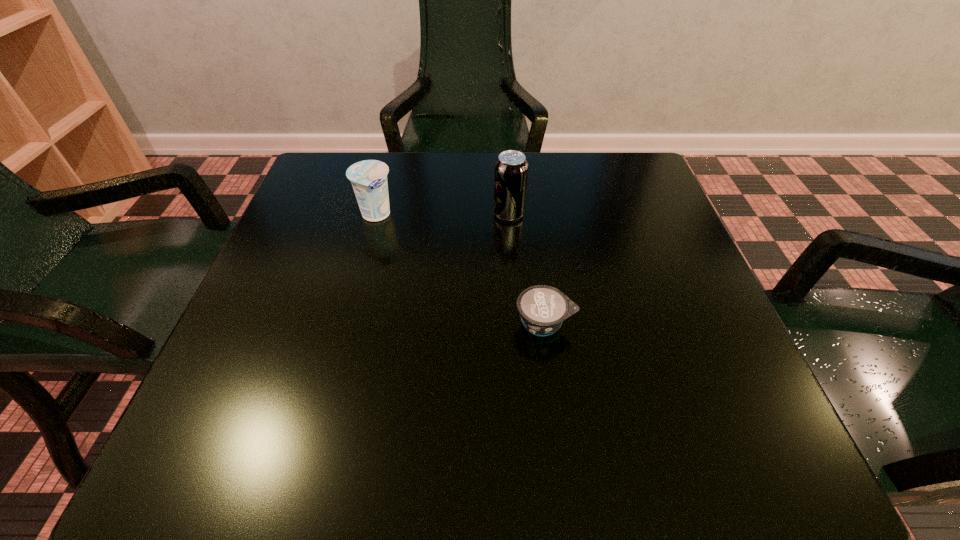
Where is `the tallest object`? The width and height of the screenshot is (960, 540). the tallest object is located at coordinates (511, 169).

You are a GUI agent. You are given a task and a screenshot of the screen. Output one action in this format:
    pyautogui.click(x=<x>, y=<y>)
    Task: Click on the taller yogurt
    This screenshot has height=540, width=960.
    Given the screenshot: What is the action you would take?
    pyautogui.click(x=368, y=178)

Find the location of a particular element. The width and height of the screenshot is (960, 540). the farther yogurt is located at coordinates (368, 178).

I want to click on the nearest object, so click(x=542, y=308).

The width and height of the screenshot is (960, 540). I want to click on the nearer yogurt, so click(x=542, y=308).

I want to click on vacant space located on the front of the soda can, so click(x=520, y=375).

Locate an element on the screen. vacant region located 0.130m on the left of the taller yogurt is located at coordinates (297, 215).

Find the location of `vacant space located on the left of the shortest object`. vacant space located on the left of the shortest object is located at coordinates (457, 323).

In order to click on soda can located at the far edge in this screenshot , I will do `click(511, 169)`.

The height and width of the screenshot is (540, 960). I want to click on yogurt that is at the far edge, so click(x=368, y=178).